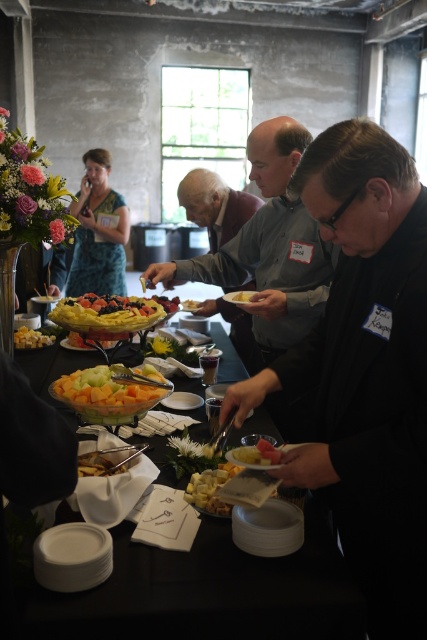
You are a guest at the event and want to grab a fruit from the translucent glass bowl of fruit at center. Where should you walk to in order to reach it?

The translucent glass bowl of fruit at center is located at point 0.619 on the x axis and 0.246 on the y axis, so you should walk towards the coordinates mentioned to reach it.

You are a guest at the buffet and want to choose between the translucent glass bowl of fruit at center and the yellow matte cheese at center. Which one is larger?

The translucent glass bowl of fruit at center is bigger than the yellow matte cheese at center, so the translucent glass bowl of fruit at center is larger.